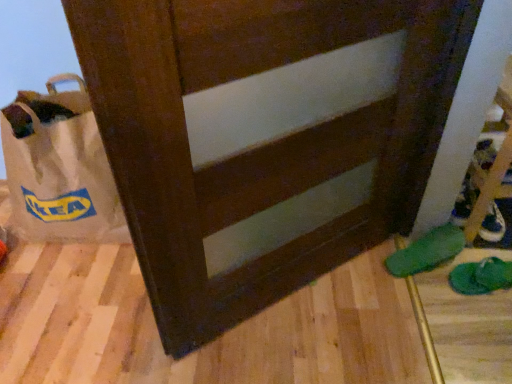
The height and width of the screenshot is (384, 512). Find the location of `green fabric slipper at lower right, acting as the second footwear starting from the left`. green fabric slipper at lower right, acting as the second footwear starting from the left is located at coordinates (481, 276).

The width and height of the screenshot is (512, 384). What do you see at coordinates (481, 276) in the screenshot? I see `green fabric slipper at lower right, acting as the second footwear starting from the left` at bounding box center [481, 276].

Locate an element on the screen. The width and height of the screenshot is (512, 384). white leather shoe at lower right is located at coordinates (494, 225).

In order to face white paper bag at left, should I rotate leftwards or rightwards?

Rotate left and turn 23.852 degrees.

Find the location of a particular element. This screenshot has height=384, width=512. green fabric slipper at lower right, the second footwear from the right is located at coordinates (426, 252).

Which is more to the right, white paper bag at left or green fabric slipper at lower right, which is counted as the first footwear, starting from the left?

green fabric slipper at lower right, which is counted as the first footwear, starting from the left, is more to the right.

Is white paper bag at left taller than green fabric slipper at lower right, the second footwear from the right?

Yes, white paper bag at left is taller than green fabric slipper at lower right, the second footwear from the right.

Would you say white paper bag at left is inside or outside green fabric slipper at lower right, which is counted as the first footwear, starting from the left?

white paper bag at left is outside green fabric slipper at lower right, which is counted as the first footwear, starting from the left.

From the picture: Which point is more distant from viewer, (442, 244) or (494, 231)?

The point (494, 231) is farther.

Can we say green fabric slipper at lower right, the second footwear from the right, lies outside white leather shoe at lower right?

Yes, green fabric slipper at lower right, the second footwear from the right, is located beyond the bounds of white leather shoe at lower right.

Who is bigger, green fabric slipper at lower right, the second footwear from the right, or white leather shoe at lower right?

green fabric slipper at lower right, the second footwear from the right, is bigger.

In the scene shown: Is green fabric slipper at lower right, the second footwear from the right, touching white leather shoe at lower right?

No, green fabric slipper at lower right, the second footwear from the right, is not beside white leather shoe at lower right.

Between green fabric slipper at lower right, acting as the second footwear starting from the left, and white leather shoe at lower right, which one is positioned in front?

green fabric slipper at lower right, acting as the second footwear starting from the left, is closer to the camera.

Can you confirm if green fabric slipper at lower right, acting as the second footwear starting from the left, is wider than white leather shoe at lower right?

Indeed, green fabric slipper at lower right, acting as the second footwear starting from the left, has a greater width compared to white leather shoe at lower right.

Is green fabric slipper at lower right, acting as the second footwear starting from the left, next to white leather shoe at lower right and touching it?

green fabric slipper at lower right, acting as the second footwear starting from the left, is not next to white leather shoe at lower right, and they're not touching.

Considering the relative sizes of green fabric slipper at lower right, positioned as the 1th footwear in right-to-left order, and green fabric slipper at lower right, which is counted as the first footwear, starting from the left, in the image provided, is green fabric slipper at lower right, positioned as the 1th footwear in right-to-left order, bigger than green fabric slipper at lower right, which is counted as the first footwear, starting from the left,?

Incorrect, green fabric slipper at lower right, positioned as the 1th footwear in right-to-left order, is not larger than green fabric slipper at lower right, which is counted as the first footwear, starting from the left.

How far apart are green fabric slipper at lower right, acting as the second footwear starting from the left, and green fabric slipper at lower right, the second footwear from the right?

green fabric slipper at lower right, acting as the second footwear starting from the left, is 4.31 inches away from green fabric slipper at lower right, the second footwear from the right.

In the image, there is a green fabric slipper at lower right, the second footwear from the right. Identify the location of footwear below it (from a real-world perspective). This screenshot has height=384, width=512. (481, 276).

From the image's perspective, is green fabric slipper at lower right, acting as the second footwear starting from the left, located above or below green fabric slipper at lower right, which is counted as the first footwear, starting from the left?

green fabric slipper at lower right, acting as the second footwear starting from the left, is below green fabric slipper at lower right, which is counted as the first footwear, starting from the left.

Does white paper bag at left have a lesser height compared to white leather shoe at lower right?

No.

Which of these two, white paper bag at left or white leather shoe at lower right, is bigger?

white paper bag at left.

Considering the relative sizes of white paper bag at left and white leather shoe at lower right in the image provided, is white paper bag at left thinner than white leather shoe at lower right?

In fact, white paper bag at left might be wider than white leather shoe at lower right.

From a real-world perspective, is white paper bag at left on white leather shoe at lower right?

Yes.

Is white leather shoe at lower right wider or thinner than green fabric slipper at lower right, acting as the second footwear starting from the left?

Clearly, white leather shoe at lower right has less width compared to green fabric slipper at lower right, acting as the second footwear starting from the left.

Where is `shoe that appears on the right of green fabric slipper at lower right, positioned as the 1th footwear in right-to-left order`? The height and width of the screenshot is (384, 512). shoe that appears on the right of green fabric slipper at lower right, positioned as the 1th footwear in right-to-left order is located at coordinates (494, 225).

Considering the sizes of white leather shoe at lower right and green fabric slipper at lower right, positioned as the 1th footwear in right-to-left order, in the image, is white leather shoe at lower right bigger or smaller than green fabric slipper at lower right, positioned as the 1th footwear in right-to-left order,?

In the image, white leather shoe at lower right appears to be smaller than green fabric slipper at lower right, positioned as the 1th footwear in right-to-left order.

From the picture: Could you tell me if white leather shoe at lower right is facing green fabric slipper at lower right, positioned as the 1th footwear in right-to-left order?

No, white leather shoe at lower right is not oriented towards green fabric slipper at lower right, positioned as the 1th footwear in right-to-left order.

Does green fabric slipper at lower right, the second footwear from the right, lie behind white paper bag at left?

Yes, green fabric slipper at lower right, the second footwear from the right, is further from the camera.

Looking at the image, does green fabric slipper at lower right, the second footwear from the right, seem bigger or smaller compared to white paper bag at left?

green fabric slipper at lower right, the second footwear from the right, is smaller than white paper bag at left.

Is green fabric slipper at lower right, which is counted as the first footwear, starting from the left, facing towards white paper bag at left?

No, green fabric slipper at lower right, which is counted as the first footwear, starting from the left, is not oriented towards white paper bag at left.

Is green fabric slipper at lower right, the second footwear from the right, surrounding white paper bag at left?

No, white paper bag at left is not surrounded by green fabric slipper at lower right, the second footwear from the right.

The image size is (512, 384). Find the location of `the 1st footwear to the right of the white paper bag at left, counting from the anchor's position`. the 1st footwear to the right of the white paper bag at left, counting from the anchor's position is located at coordinates (426, 252).

Where is `shoe beneath the green fabric slipper at lower right, which is counted as the first footwear, starting from the left (from a real-world perspective)`? This screenshot has height=384, width=512. shoe beneath the green fabric slipper at lower right, which is counted as the first footwear, starting from the left (from a real-world perspective) is located at coordinates (494, 225).

From the picture: Looking at the image, which one is located closer to green fabric slipper at lower right, acting as the second footwear starting from the left, white leather shoe at lower right or white paper bag at left?

white leather shoe at lower right is closer to green fabric slipper at lower right, acting as the second footwear starting from the left.

Based on their spatial positions, is white leather shoe at lower right or green fabric slipper at lower right, which is counted as the first footwear, starting from the left, closer to white paper bag at left?

Based on the image, green fabric slipper at lower right, which is counted as the first footwear, starting from the left, appears to be nearer to white paper bag at left.

From the picture: Considering their positions, is green fabric slipper at lower right, the second footwear from the right, positioned further to white paper bag at left than green fabric slipper at lower right, positioned as the 1th footwear in right-to-left order?

green fabric slipper at lower right, positioned as the 1th footwear in right-to-left order, lies further to white paper bag at left than the other object.

When comparing their distances from white paper bag at left, does green fabric slipper at lower right, which is counted as the first footwear, starting from the left, or white leather shoe at lower right seem closer?

green fabric slipper at lower right, which is counted as the first footwear, starting from the left, is closer to white paper bag at left.

Considering their positions, is green fabric slipper at lower right, positioned as the 1th footwear in right-to-left order, positioned further to white paper bag at left than white leather shoe at lower right?

The object further to white paper bag at left is white leather shoe at lower right.

Which object lies further to the anchor point white leather shoe at lower right, green fabric slipper at lower right, which is counted as the first footwear, starting from the left, or green fabric slipper at lower right, positioned as the 1th footwear in right-to-left order?

Among the two, green fabric slipper at lower right, positioned as the 1th footwear in right-to-left order, is located further to white leather shoe at lower right.

Considering their positions, is green fabric slipper at lower right, positioned as the 1th footwear in right-to-left order, positioned further to green fabric slipper at lower right, the second footwear from the right, than white leather shoe at lower right?

The object further to green fabric slipper at lower right, the second footwear from the right, is white leather shoe at lower right.

When comparing their distances from green fabric slipper at lower right, positioned as the 1th footwear in right-to-left order, does green fabric slipper at lower right, the second footwear from the right, or white paper bag at left seem closer?

green fabric slipper at lower right, the second footwear from the right, lies closer to green fabric slipper at lower right, positioned as the 1th footwear in right-to-left order, than the other object.

Where is `footwear between white paper bag at left and green fabric slipper at lower right, positioned as the 1th footwear in right-to-left order, from left to right`? This screenshot has height=384, width=512. footwear between white paper bag at left and green fabric slipper at lower right, positioned as the 1th footwear in right-to-left order, from left to right is located at coordinates (426, 252).

I want to click on footwear between green fabric slipper at lower right, which is counted as the first footwear, starting from the left, and white leather shoe at lower right, so click(481, 276).